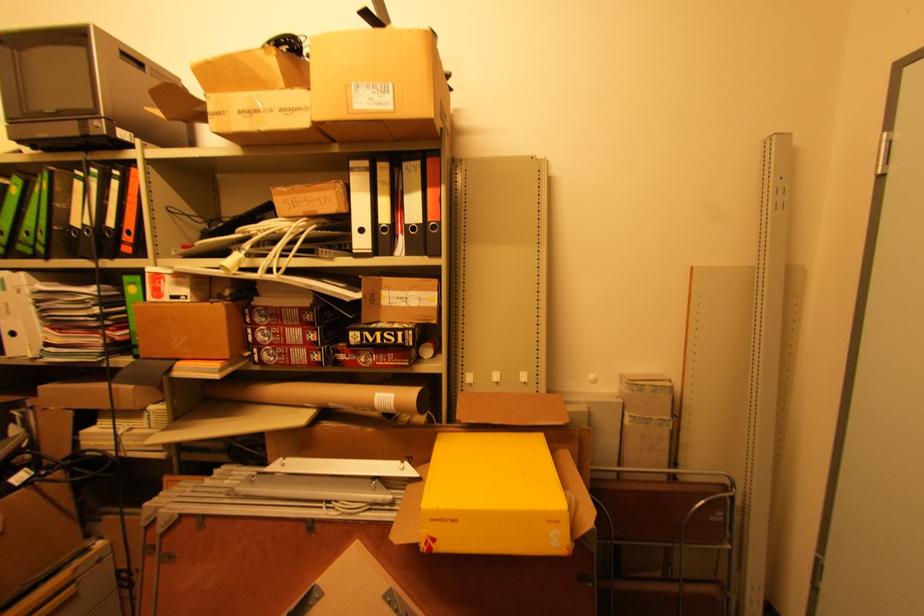
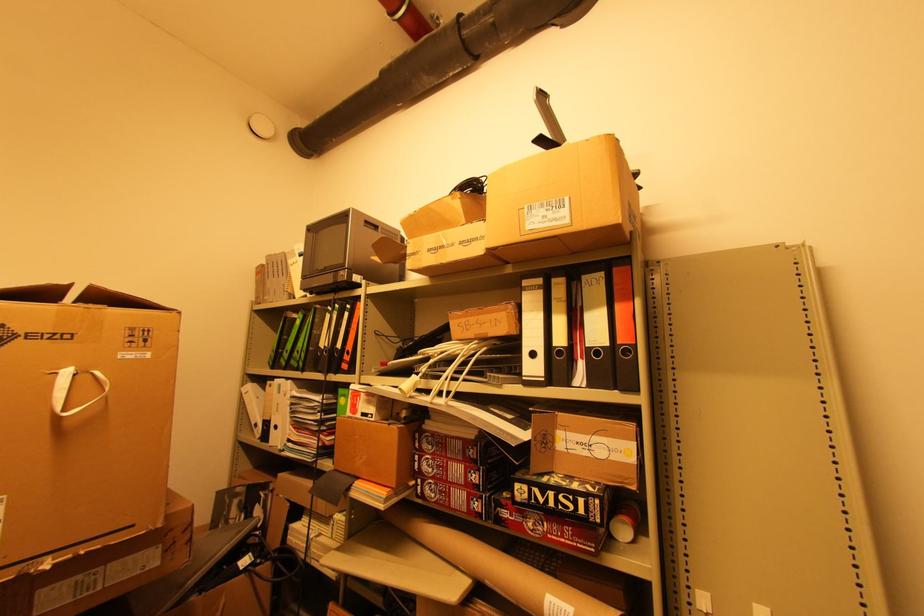
In the second image, find the point that corresponds to (x=392, y=334) in the first image.

(568, 498)